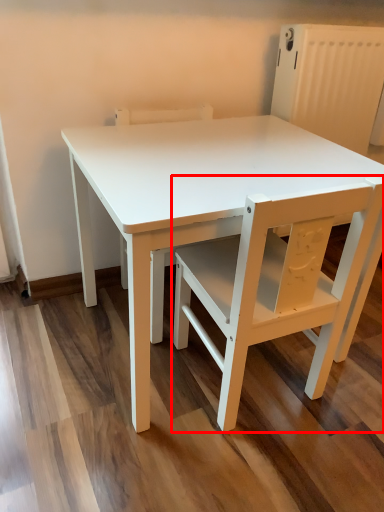
Question: Where is chair (annotated by the red box) located in relation to chair in the image?

Choices:
 (A) right
 (B) left

Answer: (A)